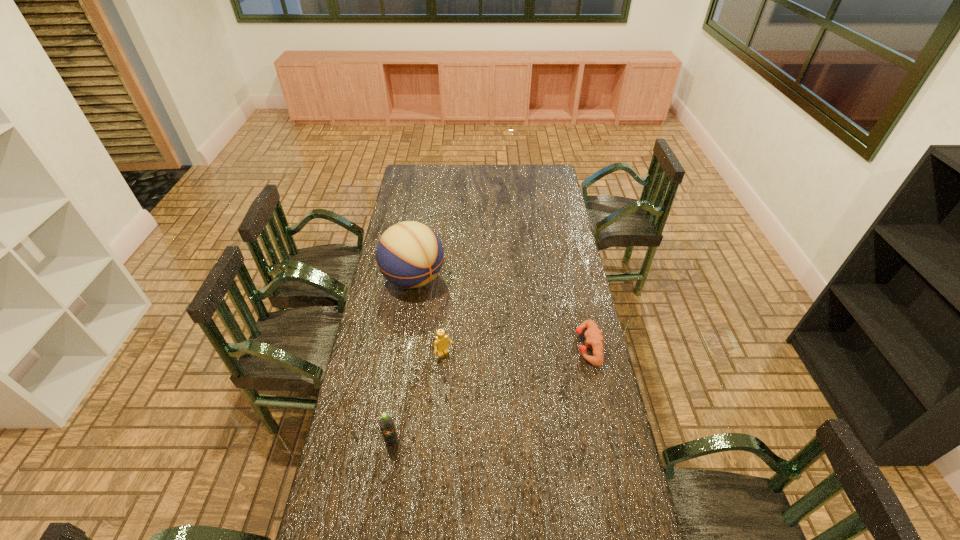
This screenshot has height=540, width=960. I want to click on free space between the shortest object and the second tallest object, so click(x=490, y=394).

At what (x,y) coordinates should I click in order to perform the action: click on free point between the second shortest object and the soda. Please return your answer as a coordinate pair (x, y). Looking at the image, I should click on pyautogui.click(x=419, y=398).

Where is `free space between the farthest object and the puncher`? This screenshot has height=540, width=960. free space between the farthest object and the puncher is located at coordinates (501, 313).

Where is `free space between the rightmost object and the Lego`? free space between the rightmost object and the Lego is located at coordinates (516, 350).

The width and height of the screenshot is (960, 540). I want to click on free space between the puncher and the second shortest object, so click(516, 350).

Choose which object is the nearest neighbor to the tallest object. Please provide its 2D coordinates. Your answer should be formatted as a tuple, i.e. [(x, y)], where the tuple contains the x and y coordinates of a point satisfying the conditions above.

[(441, 344)]

Locate an element on the screen. object that ranks as the third closest to the soda is located at coordinates (593, 335).

This screenshot has height=540, width=960. In order to click on blank space that satisfies the following two spatial constraints: 1. on the back side of the shortest object; 2. with the gloves of the Lego facing forward in this screenshot , I will do `click(445, 346)`.